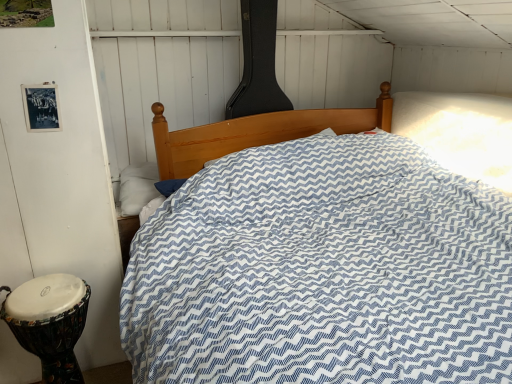
You are a GUI agent. You are given a task and a screenshot of the screen. Output one action in this format:
    pyautogui.click(x=<x>, y=<y>)
    Task: Click on the white leather drum at lower left
    
    Given the screenshot: What is the action you would take?
    pyautogui.click(x=50, y=329)

This screenshot has height=384, width=512. What do you see at coordinates (50, 329) in the screenshot?
I see `white leather drum at lower left` at bounding box center [50, 329].

The image size is (512, 384). What do you see at coordinates (137, 187) in the screenshot? I see `white soft pillow at left` at bounding box center [137, 187].

You are a GUI agent. You are given a task and a screenshot of the screen. Output one action in this format:
    pyautogui.click(x=<x>, y=<y>)
    Task: Click on the white soft pillow at left
    The width and height of the screenshot is (512, 384).
    Given the screenshot: What is the action you would take?
    pyautogui.click(x=137, y=187)

Measure the distance between point (145,170) and camera.

A distance of 7.60 feet exists between point (145,170) and camera.

Where is `white leather drum at lower left`? This screenshot has width=512, height=384. white leather drum at lower left is located at coordinates (50, 329).

Based on their positions, is white soft pillow at left located to the left or right of white leather drum at lower left?

From the image, it's evident that white soft pillow at left is to the right of white leather drum at lower left.

Is white soft pillow at left positioned before white leather drum at lower left?

No, white soft pillow at left is further to the viewer.

Is point (125, 192) closer or farther from the camera than point (42, 339)?

Point (125, 192) appears to be farther away from the viewer than point (42, 339).

From the image's perspective, is white soft pillow at left below white leather drum at lower left?

No, from the image's perspective, white soft pillow at left is not below white leather drum at lower left.

From a real-world perspective, is white soft pillow at left physically above white leather drum at lower left?

Yes, from a real-world perspective, white soft pillow at left is above white leather drum at lower left.

Considering the sizes of objects white soft pillow at left and white leather drum at lower left in the image provided, who is thinner, white soft pillow at left or white leather drum at lower left?

white soft pillow at left.

Considering the sizes of objects white soft pillow at left and white leather drum at lower left in the image provided, who is shorter, white soft pillow at left or white leather drum at lower left?

white soft pillow at left.

Considering the relative sizes of white soft pillow at left and white leather drum at lower left in the image provided, is white soft pillow at left bigger than white leather drum at lower left?

Incorrect, white soft pillow at left is not larger than white leather drum at lower left.

Is white leather drum at lower left completely or partially inside white soft pillow at left?

No.

Is white soft pillow at left placed right next to white leather drum at lower left?

No, white soft pillow at left is not with white leather drum at lower left.

Is white soft pillow at left oriented towards white leather drum at lower left?

A: Yes, white soft pillow at left is aimed at white leather drum at lower left.

In order to click on drum that is in front of the white soft pillow at left in this screenshot , I will do `click(50, 329)`.

Can you confirm if white leather drum at lower left is positioned to the left of white soft pillow at left?

Yes.

Is white leather drum at lower left behind white soft pillow at left?

No, the depth of white leather drum at lower left is less than that of white soft pillow at left.

Is point (7, 309) positioned before point (130, 195)?

Yes, it is in front of point (130, 195).

From the image's perspective, does white leather drum at lower left appear lower than white soft pillow at left?

Yes, from the image's perspective, white leather drum at lower left is beneath white soft pillow at left.

Consider the image. From a real-world perspective, does white leather drum at lower left stand above white soft pillow at left?

Actually, white leather drum at lower left is physically below white soft pillow at left in the real world.

Between white leather drum at lower left and white soft pillow at left, which one has smaller width?

white soft pillow at left is thinner.

Does white leather drum at lower left have a greater height compared to white soft pillow at left?

Yes.

Considering the sizes of white leather drum at lower left and white soft pillow at left in the image, is white leather drum at lower left bigger or smaller than white soft pillow at left?

Clearly, white leather drum at lower left is larger in size than white soft pillow at left.

From the picture: Do you think white leather drum at lower left is within white soft pillow at left, or outside of it?

The correct answer is: outside.

Is white leather drum at lower left positioned far away from white soft pillow at left?

No, white leather drum at lower left is not far from white soft pillow at left.

Looking at this image, is white leather drum at lower left oriented away from white soft pillow at left?

No, white leather drum at lower left is not facing away from white soft pillow at left.

How different are the orientations of white leather drum at lower left and white soft pillow at left in degrees?

The angle between the facing direction of white leather drum at lower left and the facing direction of white soft pillow at left is 0.00105 degrees.

Measure the distance between white leather drum at lower left and white soft pillow at left.

white leather drum at lower left is 78.60 centimeters from white soft pillow at left.

Where is `drum that is under the white soft pillow at left (from a real-world perspective)`? drum that is under the white soft pillow at left (from a real-world perspective) is located at coordinates (50, 329).

Locate an element on the screen. drum that appears on the left of white soft pillow at left is located at coordinates (50, 329).

There is a white leather drum at lower left. Where is `pillow above it (from a real-world perspective)`? The width and height of the screenshot is (512, 384). pillow above it (from a real-world perspective) is located at coordinates (137, 187).